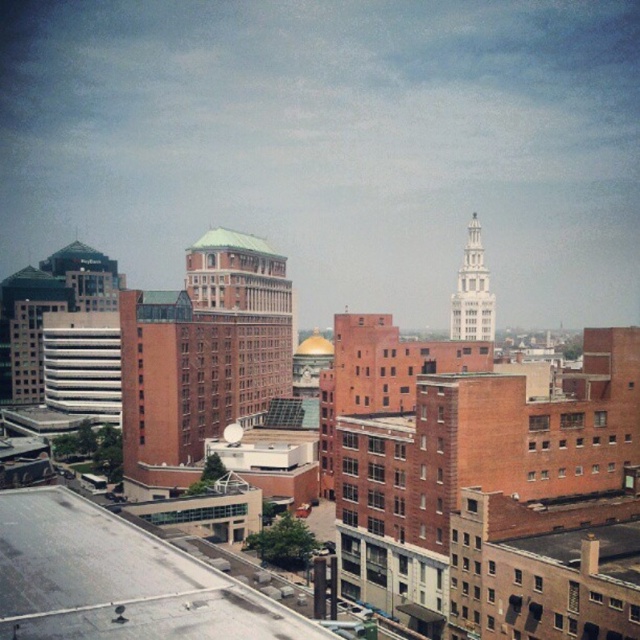
Does white stone tower at upper right appear over green metallic roof at center?

Actually, white stone tower at upper right is below green metallic roof at center.

Can you confirm if white stone tower at upper right is wider than green metallic roof at center?

In fact, white stone tower at upper right might be narrower than green metallic roof at center.

This screenshot has height=640, width=640. In order to click on white stone tower at upper right in this screenshot , I will do `click(472, 292)`.

Image resolution: width=640 pixels, height=640 pixels. I want to click on white stone tower at upper right, so click(472, 292).